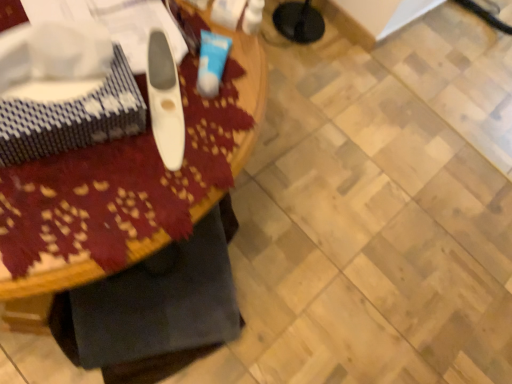
Find the location of a particular element. This screenshot has width=512, height=384. unoccupied region to the right of wooden table at center is located at coordinates (336, 249).